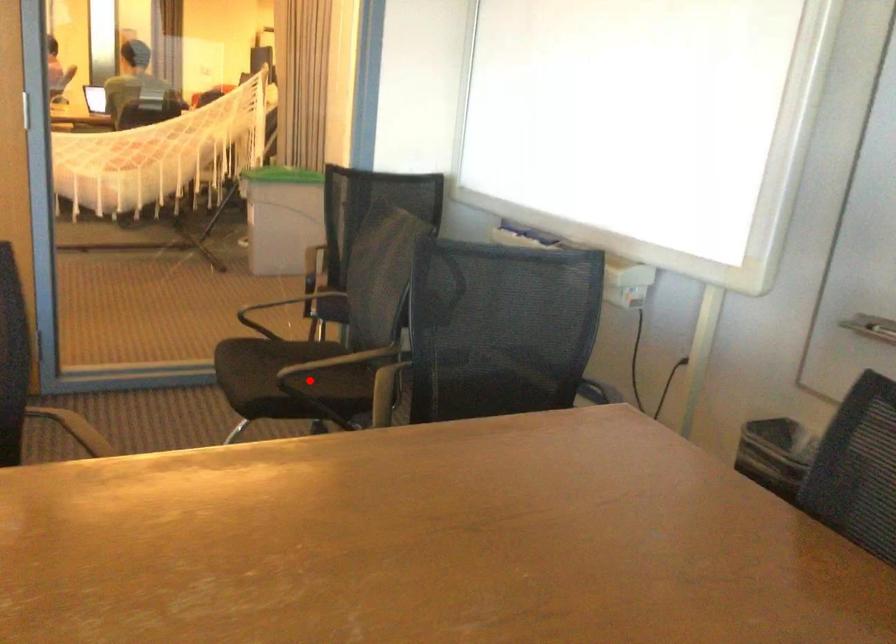
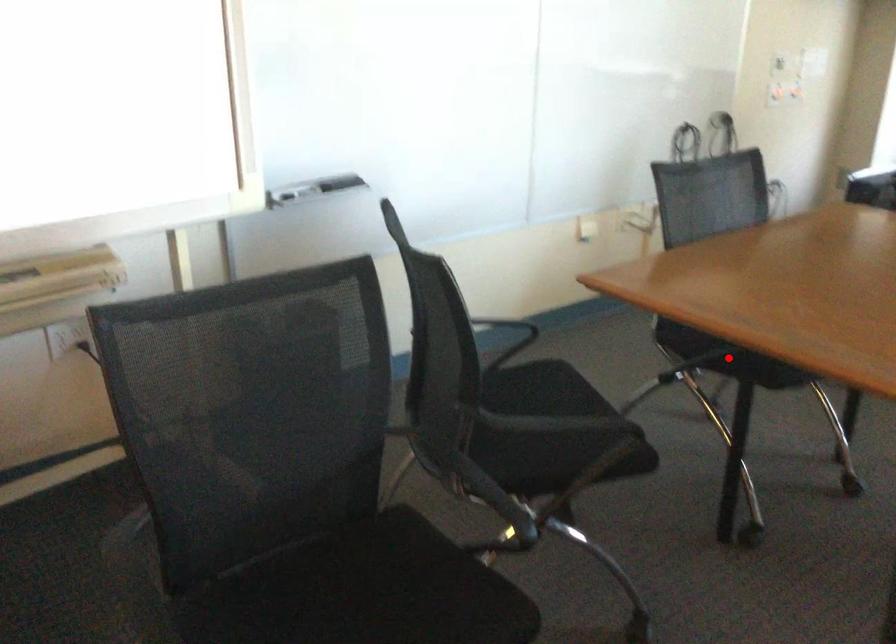
I am providing you with two images of the same scene from different viewpoints. A red point is marked on the first image and another point is marked on the second image. Is the red point in image1 aligned with the point shown in image2?

No